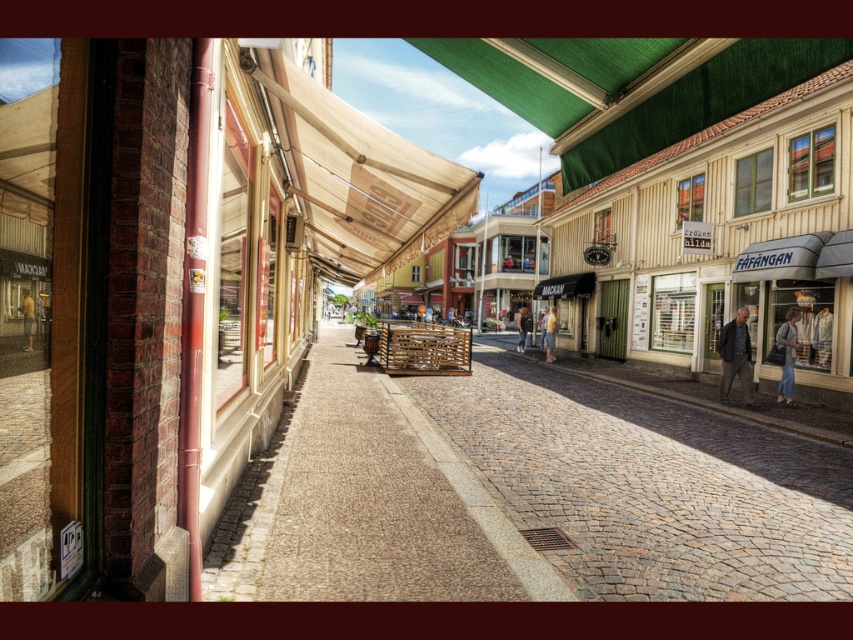
You are standing at the entrance of the store with large windows on the left side of the cobblestone street. You need to locate the dark gray suit at right. According to the coordinates given, where should you look relative to the store entrance?

The dark gray suit at right is located at coordinates point (735, 356), which means it is positioned to the right and slightly above the store entrance.

You are a tourist standing on the cobblestone street and want to take a photo of the dark gray suit at right. Where should you position yourself to capture it in the frame?

The dark gray suit at right is located at point 0.559 on the x axis and 0.863 on the y axis, so you should position yourself facing the right side of the street, slightly towards the middle to ensure the dark gray suit at right is centered in your photo.

You are a tailor standing in the middle of the cobblestone street. You need to hang a new coat that is 1.8 meters tall. Which of the two items, the dark gray suit at right or the light brown leather jacket at center, can accommodate the new coat in terms of height?

The light brown leather jacket at center is taller than the dark gray suit at right. Since the new coat is 1.8 meters tall, you should check the height of both items. If the light brown leather jacket at center is taller than 1.8 meters, it can accommodate the coat. However, the dark gray suit at right is shorter, so it cannot. Therefore, the light brown leather jacket at center is the suitable option if its height meets the requirement.